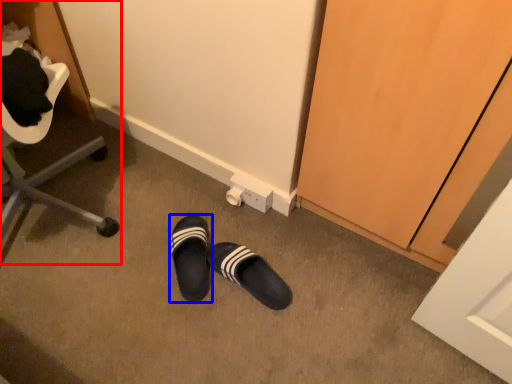
Question: Which of the following is the closest to the observer, furniture (highlighted by a red box) or footwear (highlighted by a blue box)?

Choices:
 (A) furniture
 (B) footwear

Answer: (A)